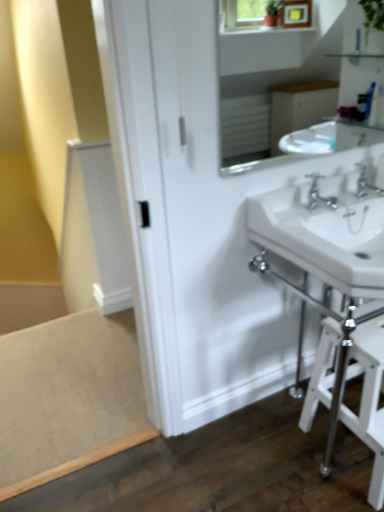
Question: From the image's perspective, is chrome metallic faucet at center, positioned as the 2th tap in right-to-left order, above or below white glossy table at lower right?

Choices:
 (A) below
 (B) above

Answer: (B)

Question: From a real-world perspective, is chrome metallic faucet at center, positioned as the 2th tap in right-to-left order, above or below white glossy table at lower right?

Choices:
 (A) above
 (B) below

Answer: (A)

Question: Which of these objects is positioned closest to the white ceramic sink at right?

Choices:
 (A) white glossy table at lower right
 (B) chrome metallic faucet at upper right, positioned as the first tap in right-to-left order
 (C) white glossy sink at upper center
 (D) chrome metallic faucet at center, positioned as the 1th tap in left-to-right order

Answer: (D)

Question: Which of these objects is positioned farthest from the white glossy sink at upper center?

Choices:
 (A) chrome metallic faucet at center, positioned as the 1th tap in left-to-right order
 (B) white glossy table at lower right
 (C) white ceramic sink at right
 (D) chrome metallic faucet at upper right, which ranks as the second tap in left-to-right order

Answer: (B)